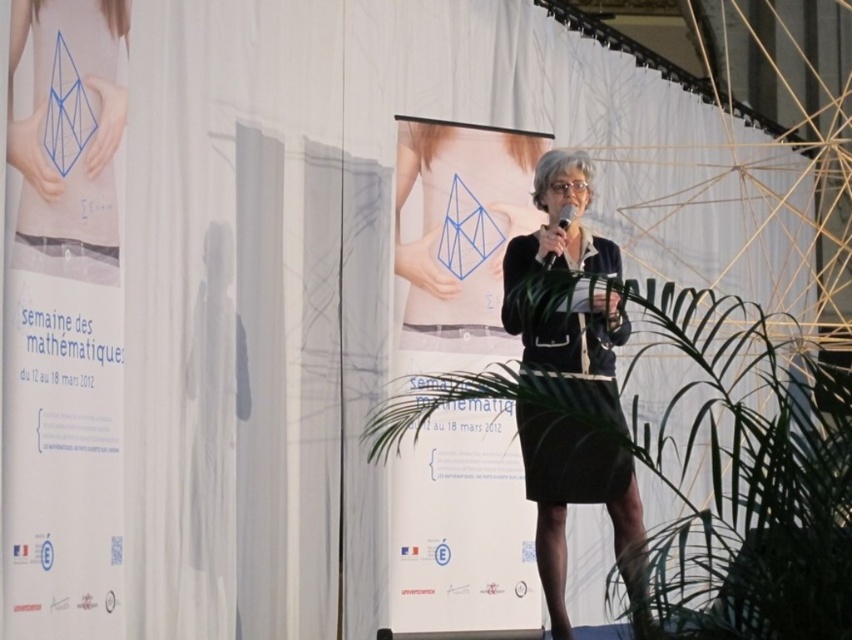
Question: Based on their relative distances, which object is nearer to the black plastic microphone at center?

Choices:
 (A) black matte dress at center
 (B) black fabric skirt at center
 (C) blue paper dress at upper left

Answer: (A)

Question: Is black matte dress at center below black plastic microphone at center?

Choices:
 (A) yes
 (B) no

Answer: (A)

Question: Considering the relative positions of black matte dress at center and blue paper dress at upper left in the image provided, where is black matte dress at center located with respect to blue paper dress at upper left?

Choices:
 (A) right
 (B) left

Answer: (A)

Question: Which of the following is the closest to the observer?

Choices:
 (A) (50, 42)
 (B) (614, 253)
 (C) (550, 259)
 (D) (579, 157)

Answer: (A)

Question: Does black fabric skirt at center appear over black plastic microphone at center?

Choices:
 (A) yes
 (B) no

Answer: (B)

Question: Which point is closer to the camera?

Choices:
 (A) (573, 211)
 (B) (101, 113)

Answer: (B)